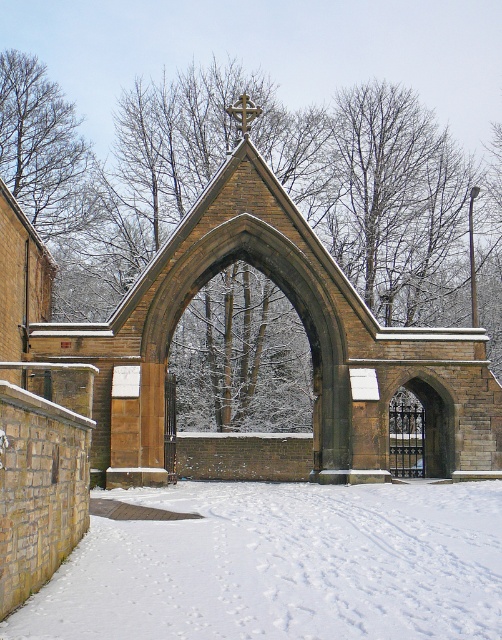
In the scene shown: Which is more to the left, white powdery snow at lower center or brown stone church at center?

white powdery snow at lower center is more to the left.

Can you confirm if white powdery snow at lower center is positioned to the left of brown stone church at center?

Yes, white powdery snow at lower center is to the left of brown stone church at center.

The height and width of the screenshot is (640, 502). Identify the location of white powdery snow at lower center. (282, 564).